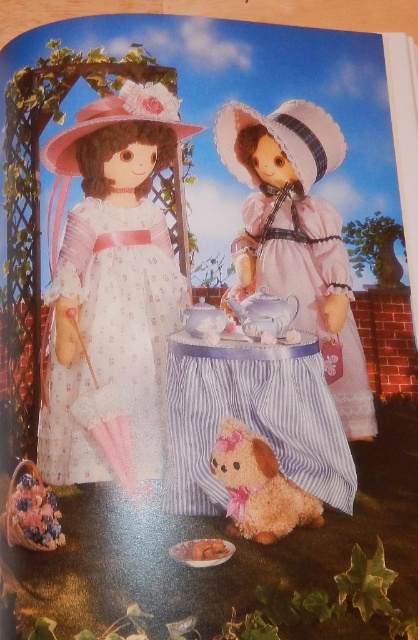
Question: Does matte white porcelain teapot at left have a greater width compared to pink satin doll at center?

Choices:
 (A) yes
 (B) no

Answer: (A)

Question: Which point is farther to the camera?

Choices:
 (A) fluffy beige plush dog at lower center
 (B) white floral fabric dress at left
 (C) matte white porcelain teapot at left

Answer: (B)

Question: Among these points, which one is farthest from the camera?

Choices:
 (A) (349, 468)
 (B) (94, 323)

Answer: (B)

Question: Does white floral fabric dress at left lie in front of striped fabric table at center?

Choices:
 (A) no
 (B) yes

Answer: (A)

Question: In this image, where is striped fabric table at center located relative to brown plush toy at lower center?

Choices:
 (A) right
 (B) left

Answer: (A)

Question: Which object appears closest to the camera in this image?

Choices:
 (A) brown plush toy at lower center
 (B) fluffy beige plush dog at lower center

Answer: (A)